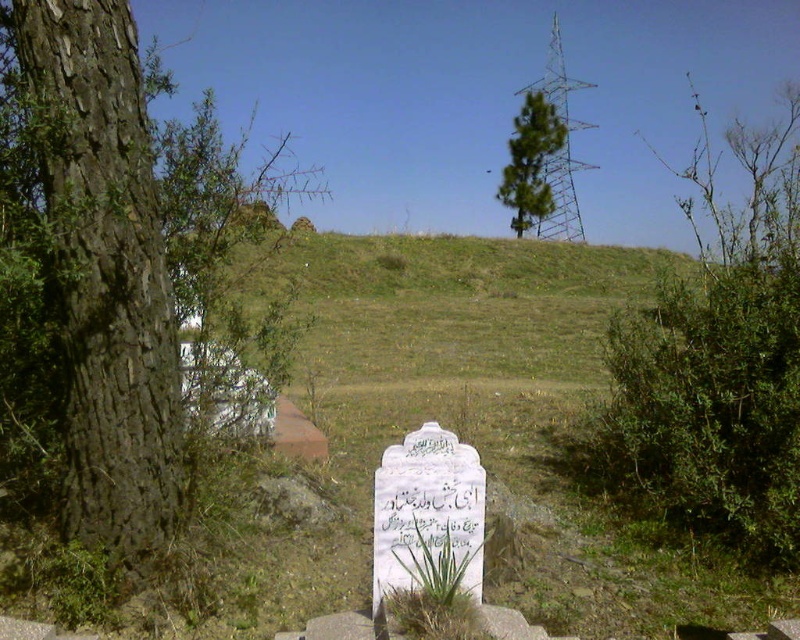
Who is lower down, green leafy bush at upper right or white stone writing at center?

white stone writing at center

Locate an element on the screen. green leafy bush at upper right is located at coordinates 720,358.

Does point (764, 179) lie behind point (398, 499)?

Yes, point (764, 179) is farther from viewer.

Locate an element on the screen. This screenshot has width=800, height=640. green leafy bush at upper right is located at coordinates (720, 358).

Is brown rough bark tree at left further to the viewer compared to white stone writing at center?

Yes, it is behind white stone writing at center.

Does point (140, 374) lie in front of point (454, 525)?

No, (140, 374) is further to viewer.

The width and height of the screenshot is (800, 640). I want to click on brown rough bark tree at left, so click(106, 276).

Between point (110, 557) and point (518, 212), which one is positioned in front?

Point (110, 557) is more forward.

Does brown rough bark tree at left have a lesser width compared to green leafy tree at upper center?

Yes, brown rough bark tree at left is thinner than green leafy tree at upper center.

The image size is (800, 640). What do you see at coordinates (106, 276) in the screenshot?
I see `brown rough bark tree at left` at bounding box center [106, 276].

Where is `brown rough bark tree at left`? Image resolution: width=800 pixels, height=640 pixels. brown rough bark tree at left is located at coordinates (106, 276).